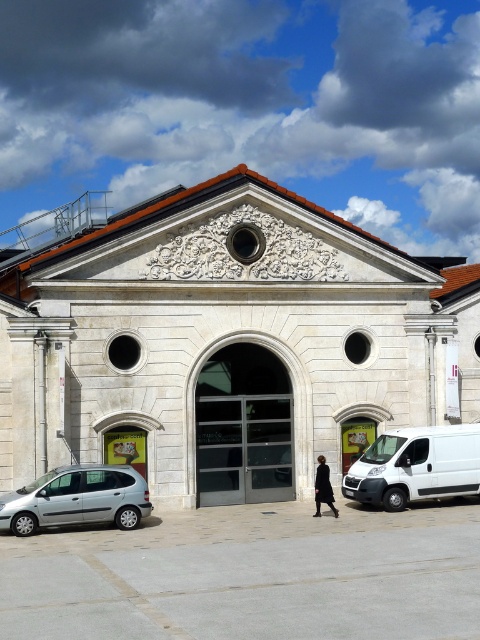
Question: Does white matte van at center come in front of black matte coat at center?

Choices:
 (A) no
 (B) yes

Answer: (A)

Question: In this image, where is white stone church at center located relative to black matte coat at center?

Choices:
 (A) above
 (B) below

Answer: (A)

Question: Which point appears closest to the camera in this image?

Choices:
 (A) (397, 436)
 (B) (2, 513)
 (C) (251, 339)
 (D) (333, 496)

Answer: (B)

Question: Which object is positioned closest to the white stone church at center?

Choices:
 (A) black matte coat at center
 (B) silver metallic minivan at lower left

Answer: (B)

Question: Which object is farther from the camera taking this photo?

Choices:
 (A) white matte van at center
 (B) silver metallic minivan at lower left
 (C) white stone church at center

Answer: (A)

Question: Is white stone church at center further to the viewer compared to silver metallic minivan at lower left?

Choices:
 (A) yes
 (B) no

Answer: (A)